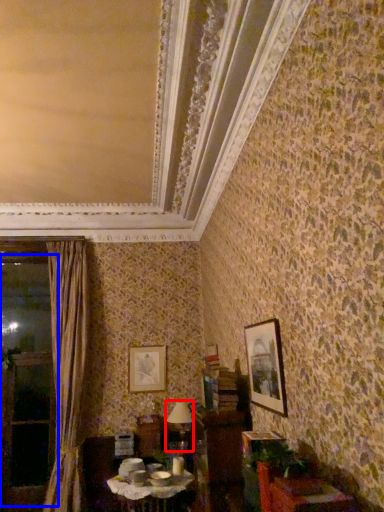
Question: Among these objects, which one is farthest to the camera, table lamp (highlighted by a red box) or window (highlighted by a blue box)?

Choices:
 (A) table lamp
 (B) window

Answer: (B)